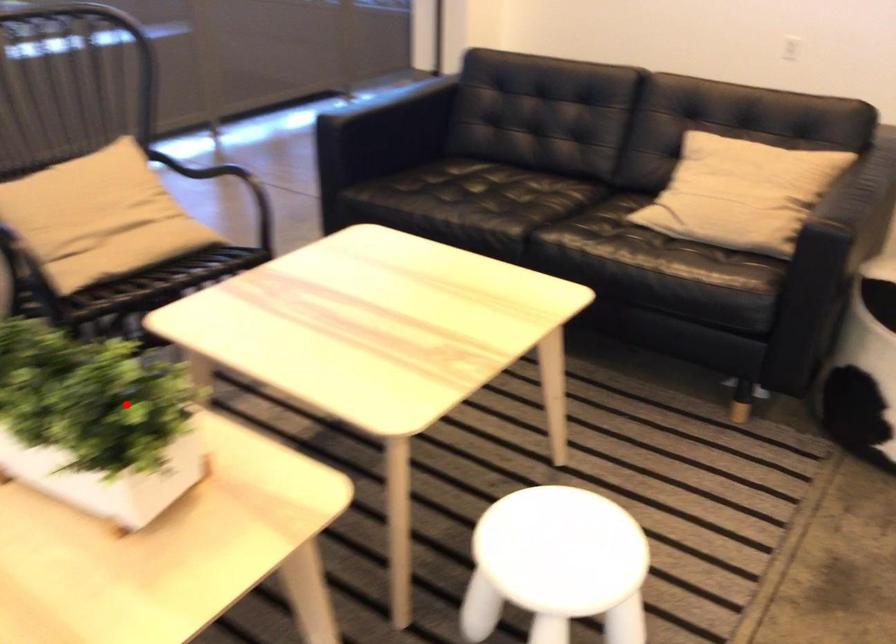
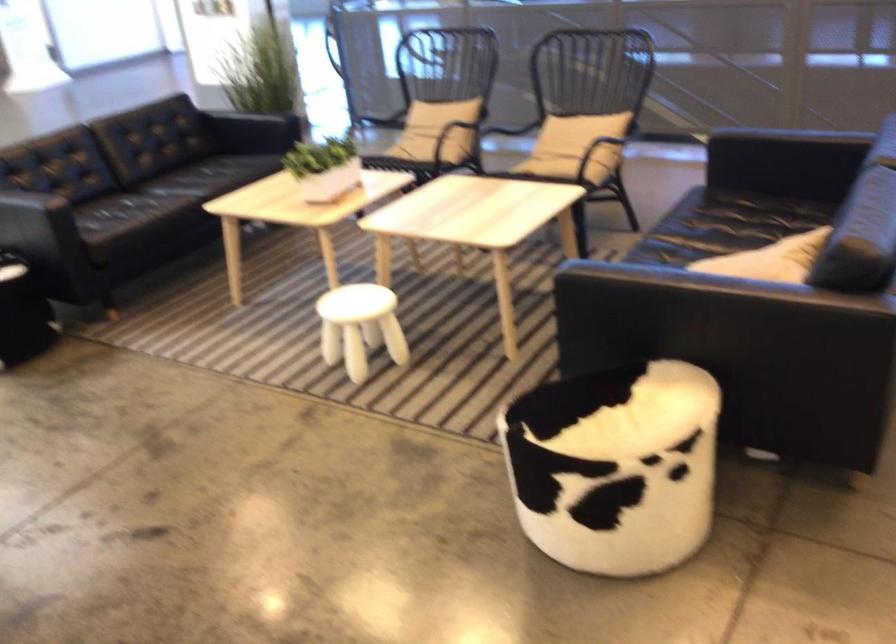
Locate, in the second image, the point that corresponds to the highlighted location in the first image.

(323, 167)